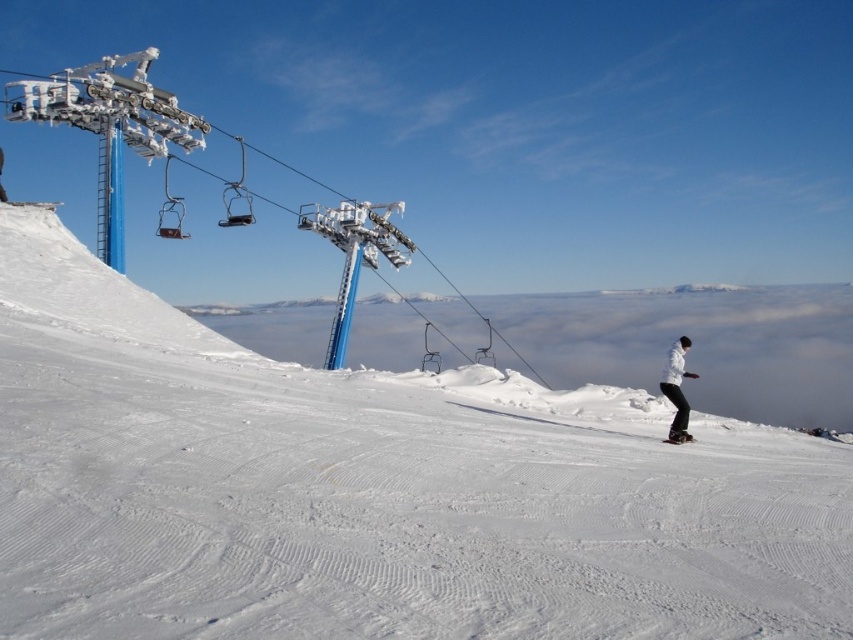
Based on the photo, you are a drone operator tasked with capturing aerial footage of the ski slope. The white matte snowboarder at right is currently at position coordinates. To ensure safety, you need to maintain a minimum distance of 5 meters from the snowboarder. If your drone is currently at coordinates point A, which is 10 meters away from the snowboarder, can you safely fly the drone closer to capture better footage?

The white matte snowboarder at right is located at point coordinates. Since the drone is currently 10 meters away, which is already beyond the minimum safe distance of 5 meters, you can safely fly the drone closer to capture better footage as long as you maintain at least 5 meters distance.